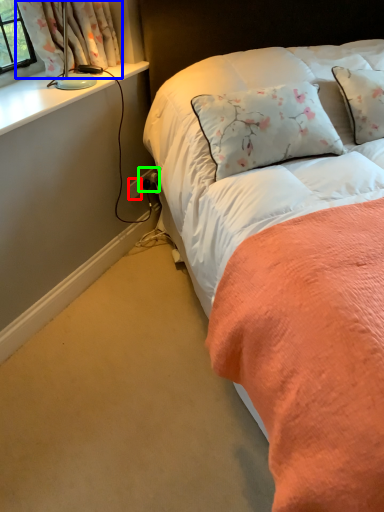
Question: Considering the real-world distances, which object is farthest from power outlet (highlighted by a red box)? curtain (highlighted by a blue box) or electric outlet (highlighted by a green box)?

Choices:
 (A) curtain
 (B) electric outlet

Answer: (A)